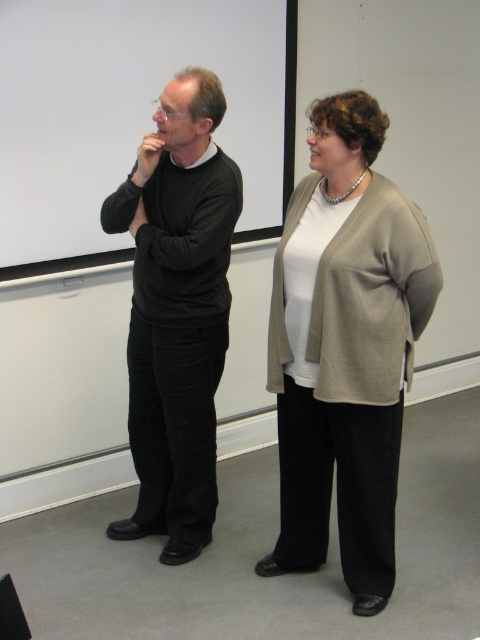
Is point (323, 506) farther from camera compared to point (208, 250)?

That is True.

Which is above, beige sweater at center or black ribbed sweater at left?

black ribbed sweater at left is above.

Where is `beige sweater at center`? This screenshot has height=640, width=480. beige sweater at center is located at coordinates (345, 348).

What do you see at coordinates (130, 113) in the screenshot?
I see `white matte projection screen at upper center` at bounding box center [130, 113].

Where is `white matte projection screen at upper center`? white matte projection screen at upper center is located at coordinates (130, 113).

Where is `white matte projection screen at upper center`? white matte projection screen at upper center is located at coordinates (130, 113).

Who is taller, beige sweater at center or white matte projection screen at upper center?

beige sweater at center

Is beige sweater at center bigger than white matte projection screen at upper center?

No.

Is point (370, 113) farther from camera compared to point (55, 118)?

That is False.

The height and width of the screenshot is (640, 480). In order to click on beige sweater at center in this screenshot , I will do `click(345, 348)`.